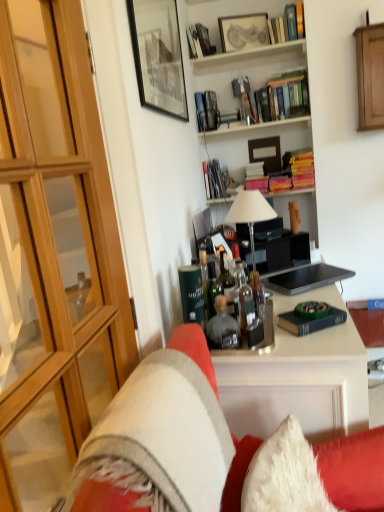
The image size is (384, 512). In order to click on light wood cabinet at left, which is counted as the 2th cabinetry, starting from the top in this screenshot , I will do `click(52, 220)`.

Measure the distance between hardcover books at upper center, the 3th book from the bottom, and camera.

8.41 feet.

Find the location of a particular element. hardcover book at center, arranged as the 1th book when viewed from the back is located at coordinates (214, 180).

Looking at this image, what is the approximate height of hardcover book at center, which is the 7th book from front to back?

hardcover book at center, which is the 7th book from front to back, is 10.41 inches in height.

What do you see at coordinates (222, 327) in the screenshot? I see `translucent glass bottle at center, which is the 2th bottle from back to front` at bounding box center [222, 327].

Identify the location of wooden cabinet at upper right, the first cabinetry when ordered from back to front. This screenshot has height=512, width=384. (370, 76).

You are a GUI agent. You are given a task and a screenshot of the screen. Output one action in this format:
    pyautogui.click(x=<x>, y=<y>)
    Task: Click on the velvet-like beige couch at center
    
    Given the screenshot: What is the action you would take?
    pyautogui.click(x=104, y=499)

In the scene shown: Can you tell me how much translucent glass bottle at center, which is the 2th bottle from back to front, and hardcover book at upper center, the 6th book when ordered from back to front, differ in facing direction?

The angular difference between translucent glass bottle at center, which is the 2th bottle from back to front, and hardcover book at upper center, the 6th book when ordered from back to front, is 83.4 degrees.

Considering the sizes of objects translucent glass bottle at center, the 1th bottle positioned from the left, and hardcover book at upper center, positioned as the seventh book in bottom-to-top order, in the image provided, who is shorter, translucent glass bottle at center, the 1th bottle positioned from the left, or hardcover book at upper center, positioned as the seventh book in bottom-to-top order,?

hardcover book at upper center, positioned as the seventh book in bottom-to-top order, is shorter.

Considering the sizes of objects translucent glass bottle at center, arranged as the second bottle when viewed from the right, and hardcover book at upper center, placed as the second book when sorted from front to back, in the image provided, who is thinner, translucent glass bottle at center, arranged as the second bottle when viewed from the right, or hardcover book at upper center, placed as the second book when sorted from front to back,?

translucent glass bottle at center, arranged as the second bottle when viewed from the right, is thinner.

From the image's perspective, starting from the translucent glass bottle at center, arranged as the second bottle when viewed from the right, which book is the 6th one above? Please provide its 2D coordinates.

[(287, 24)]

Which is correct: metallic silver book at upper center, acting as the 4th book starting from the bottom, is inside velvet-like beige couch at center, or outside of it?

metallic silver book at upper center, acting as the 4th book starting from the bottom, lies outside velvet-like beige couch at center.

Considering the positions of objects metallic silver book at upper center, acting as the 4th book starting from the bottom, and velvet-like beige couch at center in the image provided, who is in front, metallic silver book at upper center, acting as the 4th book starting from the bottom, or velvet-like beige couch at center?

Positioned in front is velvet-like beige couch at center.

Considering the relative sizes of metallic silver book at upper center, positioned as the 6th book in front-to-back order, and velvet-like beige couch at center in the image provided, is metallic silver book at upper center, positioned as the 6th book in front-to-back order, bigger than velvet-like beige couch at center?

No, metallic silver book at upper center, positioned as the 6th book in front-to-back order, is not bigger than velvet-like beige couch at center.

Image resolution: width=384 pixels, height=512 pixels. I want to click on book that is the 6th one when counting backward from the velvet-like beige couch at center, so click(x=206, y=111).

Between matte black picture frame at upper center, the second picture frame from the bottom, and light wood cabinet at left, which is counted as the 2th cabinetry, starting from the top, which one has larger size?

With larger size is light wood cabinet at left, which is counted as the 2th cabinetry, starting from the top.

From the image's perspective, relative to light wood cabinet at left, which is the 1th cabinetry in left-to-right order, is matte black picture frame at upper center, the 2th picture frame in the left-to-right sequence, above or below?

From the image's perspective, matte black picture frame at upper center, the 2th picture frame in the left-to-right sequence, appears above light wood cabinet at left, which is the 1th cabinetry in left-to-right order.

Is matte black picture frame at upper center, the first picture frame when ordered from right to left, wider or thinner than light wood cabinet at left, the 2th cabinetry in the right-to-left sequence?

Considering their sizes, matte black picture frame at upper center, the first picture frame when ordered from right to left, looks slimmer than light wood cabinet at left, the 2th cabinetry in the right-to-left sequence.

Based on their sizes in the image, would you say metallic silver book at upper center, which appears as the second book when viewed from the back, is bigger or smaller than wooden bookshelf at upper center, the 3th shelf in the top-to-bottom sequence?

Clearly, metallic silver book at upper center, which appears as the second book when viewed from the back, is smaller in size than wooden bookshelf at upper center, the 3th shelf in the top-to-bottom sequence.

Considering the sizes of metallic silver book at upper center, positioned as the 6th book in front-to-back order, and wooden bookshelf at upper center, the 3th shelf in the top-to-bottom sequence, in the image, is metallic silver book at upper center, positioned as the 6th book in front-to-back order, wider or thinner than wooden bookshelf at upper center, the 3th shelf in the top-to-bottom sequence,?

In the image, metallic silver book at upper center, positioned as the 6th book in front-to-back order, appears to be more narrow than wooden bookshelf at upper center, the 3th shelf in the top-to-bottom sequence.

Is metallic silver book at upper center, which appears as the second book when viewed from the back, at the right side of wooden bookshelf at upper center, the 3th shelf in the top-to-bottom sequence?

No.

Based on the photo, could you tell me if metallic silver book at upper center, which appears as the second book when viewed from the back, is facing wooden bookshelf at upper center, the 3th shelf in the top-to-bottom sequence?

No, metallic silver book at upper center, which appears as the second book when viewed from the back, is not aimed at wooden bookshelf at upper center, the 3th shelf in the top-to-bottom sequence.

Considering the positions of point (195, 104) and point (251, 104), is point (195, 104) closer or farther from the camera than point (251, 104)?

Point (195, 104) is farther from the camera than point (251, 104).

Between metallic silver book at upper center, acting as the 4th book starting from the bottom, and hardcover books at upper center, the fifth book when ordered from bottom to top, which one has larger width?

hardcover books at upper center, the fifth book when ordered from bottom to top, is wider.

Do you think metallic silver book at upper center, acting as the 4th book starting from the bottom, is within hardcover books at upper center, the fifth book when ordered from bottom to top, or outside of it?

metallic silver book at upper center, acting as the 4th book starting from the bottom, is outside hardcover books at upper center, the fifth book when ordered from bottom to top.

Based on the photo, can you confirm if metallic silver book at upper center, the 4th book positioned from the top, is taller than hardcover books at upper center, which is the 5th book from back to front?

In fact, metallic silver book at upper center, the 4th book positioned from the top, may be shorter than hardcover books at upper center, which is the 5th book from back to front.

Can you confirm if hardcover books at upper center, which ranks as the 2th shelf in top-to-bottom order, is smaller than translucent glass bottle at center, which is the 2th bottle from back to front?

No, hardcover books at upper center, which ranks as the 2th shelf in top-to-bottom order, is not smaller than translucent glass bottle at center, which is the 2th bottle from back to front.

Is there a large distance between hardcover books at upper center, which ranks as the 2th shelf in top-to-bottom order, and translucent glass bottle at center, which is the 2th bottle from back to front?

Absolutely, hardcover books at upper center, which ranks as the 2th shelf in top-to-bottom order, is distant from translucent glass bottle at center, which is the 2th bottle from back to front.

From a real-world perspective, is hardcover books at upper center, which is counted as the second shelf, starting from the bottom, positioned above or below translucent glass bottle at center, the 1th bottle positioned from the left?

hardcover books at upper center, which is counted as the second shelf, starting from the bottom, is above translucent glass bottle at center, the 1th bottle positioned from the left.

Based on the photo, is hardcover books at upper center, which is counted as the second shelf, starting from the bottom, in front of translucent glass bottle at center, arranged as the second bottle when viewed from the right?

No, hardcover books at upper center, which is counted as the second shelf, starting from the bottom, is further to the viewer.

In the scene shown: How distant is matte black picture frame at upper center, positioned as the second picture frame in front-to-back order, from hardcover books at upper center, the 3th book from the bottom?

matte black picture frame at upper center, positioned as the second picture frame in front-to-back order, is 30.48 inches away from hardcover books at upper center, the 3th book from the bottom.

Does matte black picture frame at upper center, which ranks as the 1th picture frame in back-to-front order, have a larger size compared to hardcover books at upper center, which appears as the fifth book when viewed from the top?

Incorrect, matte black picture frame at upper center, which ranks as the 1th picture frame in back-to-front order, is not larger than hardcover books at upper center, which appears as the fifth book when viewed from the top.

Is matte black picture frame at upper center, the second picture frame from the bottom, to the right of hardcover books at upper center, acting as the fourth book starting from the front, from the viewer's perspective?

No, matte black picture frame at upper center, the second picture frame from the bottom, is not to the right of hardcover books at upper center, acting as the fourth book starting from the front.

Is matte black picture frame at upper center, which is the first picture frame in top-to-bottom order, inside the boundaries of hardcover books at upper center, which appears as the fifth book when viewed from the top, or outside?

The correct answer is: outside.

Locate an element on the screen. the 2nd bottle in front of the hardcover book at upper center, the 6th book when ordered from back to front, counting from the anchor's position is located at coordinates (222, 327).

The height and width of the screenshot is (512, 384). I want to click on the 4th book located above the velvet-like beige couch at center (from a real-world perspective), so click(x=206, y=111).

Which object lies nearer to the anchor point matte black picture frame at upper center, the first picture frame when ordered from right to left, light wood cabinet at left, which is the first cabinetry in front-to-back order, or hardcover books at upper center, arranged as the 3th book when viewed from the front?

hardcover books at upper center, arranged as the 3th book when viewed from the front, is positioned closer to the anchor matte black picture frame at upper center, the first picture frame when ordered from right to left.

From the image, which object appears to be farther from hardcover book at upper center, which is the 3th book from back to front, black matte laptop at center or white glass table lamp at center?

Among the two, black matte laptop at center is located further to hardcover book at upper center, which is the 3th book from back to front.

Which object lies nearer to the anchor point translucent glass bottle at center, arranged as the second bottle when viewed from the right, black matte laptop at center or translucent glass bottles at center, the 1th bottle from the right?

Based on the image, translucent glass bottles at center, the 1th bottle from the right, appears to be nearer to translucent glass bottle at center, arranged as the second bottle when viewed from the right.

Based on their spatial positions, is black matte picture frame at upper left, which is counted as the first picture frame, starting from the left, or hardcover books at upper center, which ranks as the 2th shelf in top-to-bottom order, further from wooden bookshelf at upper center, the 3th shelf in the top-to-bottom sequence?

black matte picture frame at upper left, which is counted as the first picture frame, starting from the left, is further to wooden bookshelf at upper center, the 3th shelf in the top-to-bottom sequence.

Which object lies further to the anchor point black matte picture frame at upper left, marked as the 2th picture frame in a top-to-bottom arrangement, wooden cabinet at upper right, placed as the 1th cabinetry when sorted from top to bottom, or metallic silver book at upper center, positioned as the 6th book in front-to-back order?

wooden cabinet at upper right, placed as the 1th cabinetry when sorted from top to bottom, is positioned further to the anchor black matte picture frame at upper left, marked as the 2th picture frame in a top-to-bottom arrangement.

Looking at the image, which one is located closer to hardcover books at upper center, which is the 3th book in top-to-bottom order, metallic silver book at upper center, positioned as the 6th book in front-to-back order, or hardcover book at upper center, which is the 6th book from bottom to top?

Based on the image, metallic silver book at upper center, positioned as the 6th book in front-to-back order, appears to be nearer to hardcover books at upper center, which is the 3th book in top-to-bottom order.

Which object lies nearer to the anchor point hardcover book at upper center, the 5th book viewed from the front, black matte picture frame at upper left, which is counted as the 2th picture frame, starting from the right, or light wood cabinet at left, which is the first cabinetry in front-to-back order?

black matte picture frame at upper left, which is counted as the 2th picture frame, starting from the right.

Which object lies further to the anchor point light wood cabinet at left, which is the first cabinetry in front-to-back order, wooden bookshelf at upper center, the 1th shelf positioned from the top, or matte black picture frame at upper center, which ranks as the 1th picture frame in back-to-front order?

Among the two, wooden bookshelf at upper center, the 1th shelf positioned from the top, is located further to light wood cabinet at left, which is the first cabinetry in front-to-back order.

Where is `picture frame between wooden cabinet at upper right, placed as the 1th cabinetry when sorted from top to bottom, and translucent glass bottle at center, the 1th bottle positioned from the left, in the up-down direction`? The width and height of the screenshot is (384, 512). picture frame between wooden cabinet at upper right, placed as the 1th cabinetry when sorted from top to bottom, and translucent glass bottle at center, the 1th bottle positioned from the left, in the up-down direction is located at coordinates (158, 56).

Identify the location of bottle located between translucent glass bottle at center, arranged as the second bottle when viewed from the right, and black matte laptop at center in the depth direction. This screenshot has height=512, width=384. (243, 297).

Identify the location of cabinetry between velvet-like beige couch at center and wooden bookshelf at upper center, placed as the first shelf when sorted from bottom to top, from front to back. The image size is (384, 512). (370, 76).

Identify the location of book between translucent glass bottle at center, which is the 2th bottle from back to front, and black matte laptop at center in the front-back direction. This screenshot has width=384, height=512. [x=311, y=318].